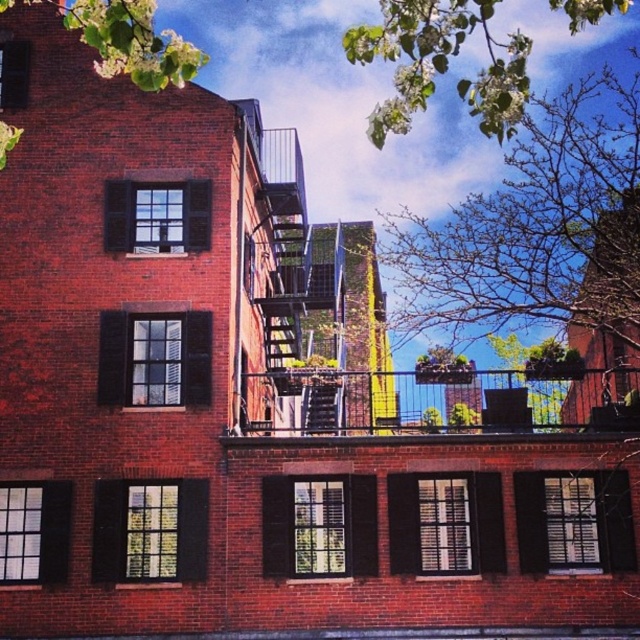
Question: Which point is farther to the camera?

Choices:
 (A) coord(419,58)
 (B) coord(160,38)
 (C) coord(451,424)

Answer: (C)

Question: From the image, what is the correct spatial relationship of green leafy branches at upper center in relation to green leafy tree at upper left?

Choices:
 (A) right
 (B) left

Answer: (A)

Question: Can you confirm if metallic silver balcony at center is positioned to the right of green leafy tree at upper left?

Choices:
 (A) yes
 (B) no

Answer: (A)

Question: In this image, where is green leafy branches at upper center located relative to green leafy tree at upper left?

Choices:
 (A) right
 (B) left

Answer: (A)

Question: Which object appears farthest from the camera in this image?

Choices:
 (A) green leafy tree at upper left
 (B) green leafy branches at upper center

Answer: (A)

Question: Which of the following is the farthest from the observer?

Choices:
 (A) green leafy tree at upper left
 (B) metallic silver balcony at center
 (C) green leafy branches at upper center

Answer: (B)